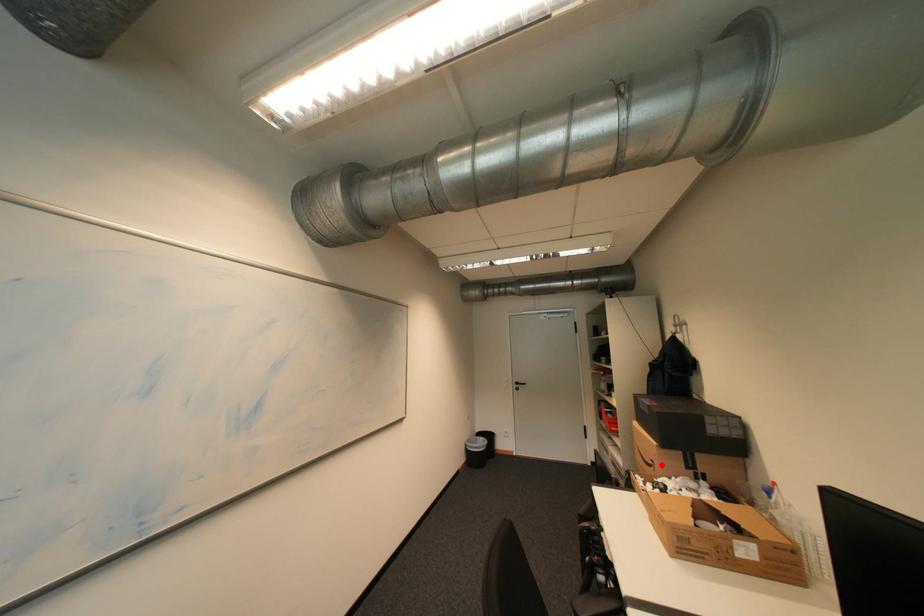
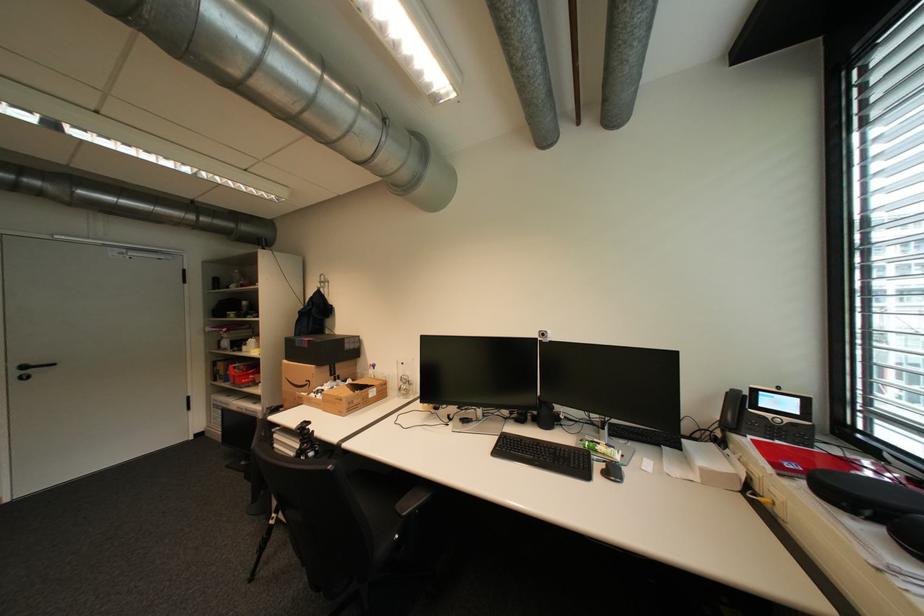
Question: A red point is marked in image1. In image2, is the corresponding 3D point closer to the camera or farther? Reply with the corresponding letter.

Choices:
 (A) The corresponding 3D point is closer.
 (B) The corresponding 3D point is farther.

Answer: (B)